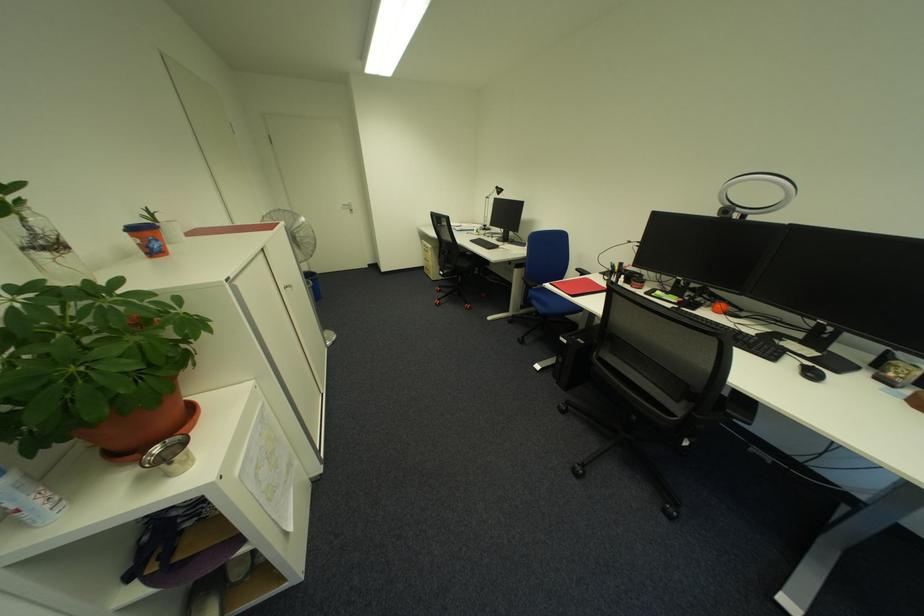
Which object does [148,238] point to?

It corresponds to the orange and blue cup in the image.